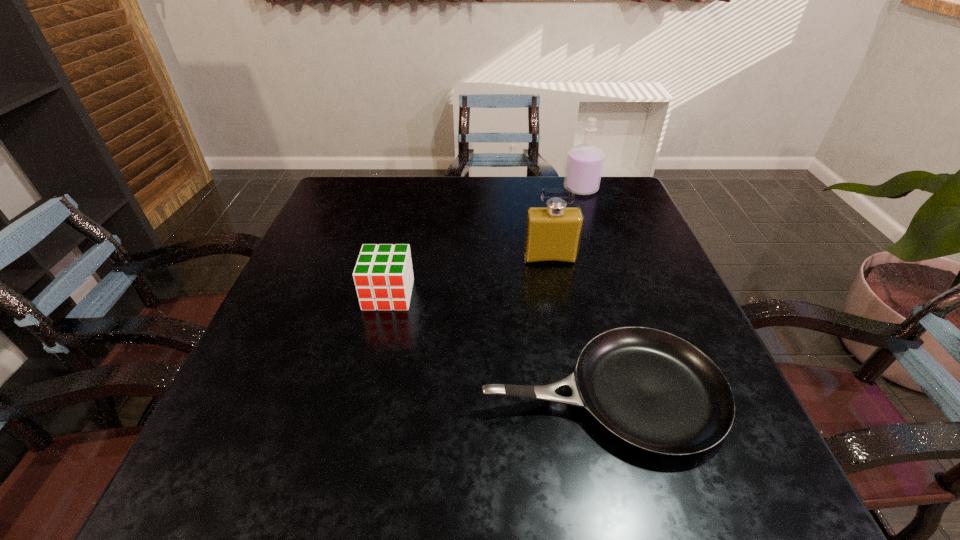
In the image, there is a desktop. What are the coordinates of `vacant space at the left edge` in the screenshot? It's located at (316, 390).

What are the coordinates of `free space at the right edge` in the screenshot? It's located at (610, 223).

The width and height of the screenshot is (960, 540). Find the location of `free space at the far left corner`. free space at the far left corner is located at coordinates (380, 196).

Find the location of a particular element. Image resolution: width=960 pixels, height=540 pixels. free spot at the near right corner of the desktop is located at coordinates (x=687, y=471).

This screenshot has width=960, height=540. I want to click on vacant space in between the shortest object and the nearer perfume, so 576,326.

Where is `empty space that is in between the nearest object and the third tallest object`? empty space that is in between the nearest object and the third tallest object is located at coordinates pos(495,345).

This screenshot has height=540, width=960. What are the coordinates of `vacant area between the cube and the second farthest object` in the screenshot? It's located at (469, 276).

The image size is (960, 540). Identify the location of free space between the shortest object and the farther perfume. (591, 292).

Where is `vacant point located between the nearest object and the cube`? vacant point located between the nearest object and the cube is located at coordinates (495, 345).

At what (x,y) coordinates should I click in order to perform the action: click on vacant area that lies between the leftmost object and the nearest object. Please return your answer as a coordinate pair (x, y). The image size is (960, 540). Looking at the image, I should click on (495, 345).